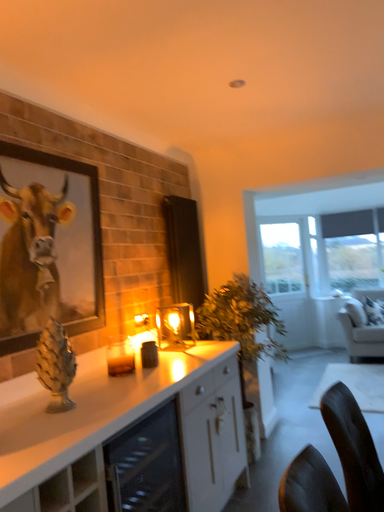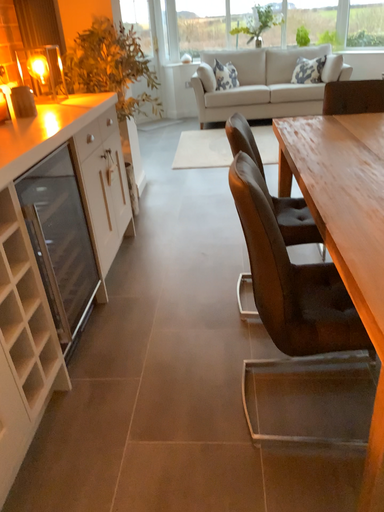
Question: Which way did the camera rotate in the video?

Choices:
 (A) rotated downward
 (B) rotated upward

Answer: (A)